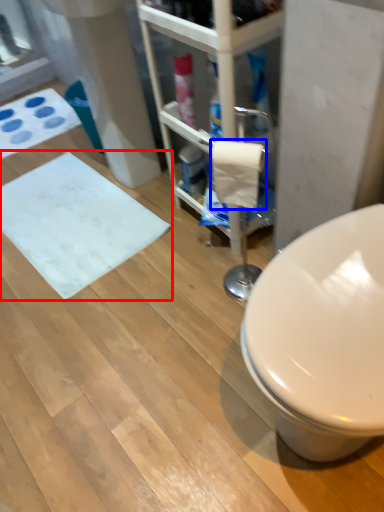
Question: Which object is closer to the camera taking this photo, bath mat (highlighted by a red box) or toilet paper (highlighted by a blue box)?

Choices:
 (A) bath mat
 (B) toilet paper

Answer: (B)